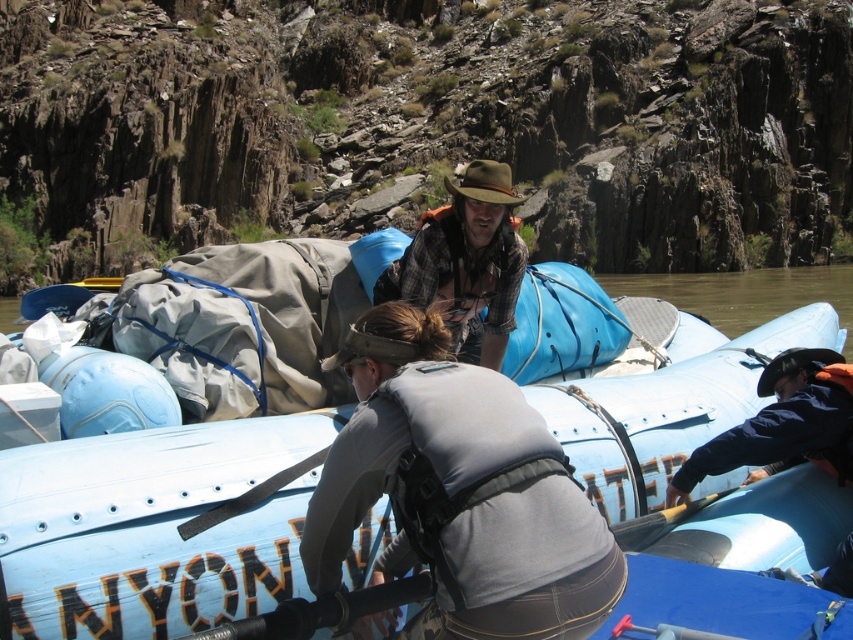
You are planning to pack your gear onto the blue inflatable raft marked ANYCON. You have a gray fabric life vest at center and a brown plaid shirt at center. Which item takes up more space on the raft?

The brown plaid shirt at center takes up more space than the gray fabric life vest at center because the gray fabric life vest at center is smaller than the brown plaid shirt at center.

Consider the image. You are on a river rafting trip and need to locate your gear. The blue rubber boat at center is where in relation to the gray fabric life vest at center?

The blue rubber boat at center is to the right of the gray fabric life vest at center.